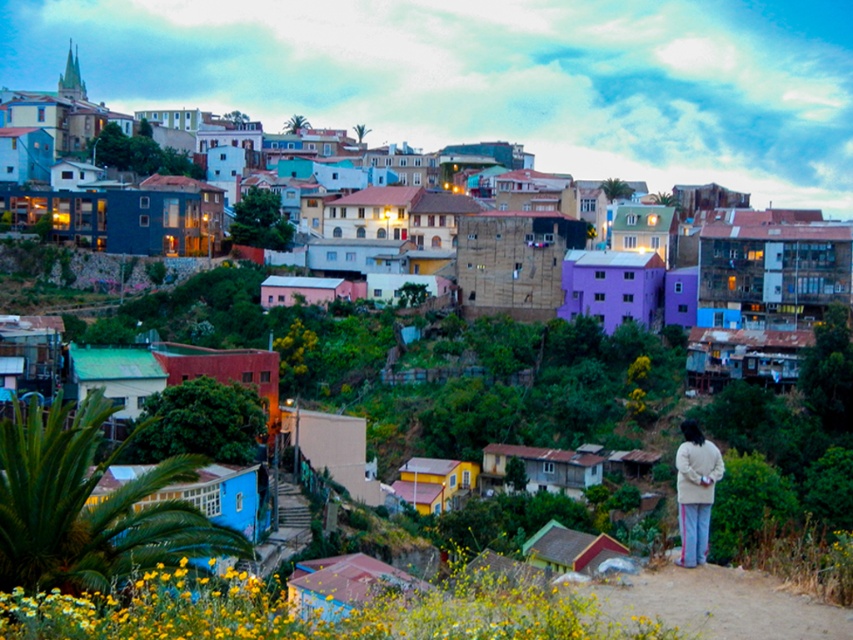
Is point (704, 38) farther from camera compared to point (708, 472)?

Yes, it is behind point (708, 472).

Can you confirm if vivid pastel houses at center is positioned below light beige sweater at lower right?

No.

Is point (326, 38) less distant than point (689, 509)?

No, it is behind (689, 509).

Image resolution: width=853 pixels, height=640 pixels. I want to click on vivid pastel houses at center, so click(x=508, y=90).